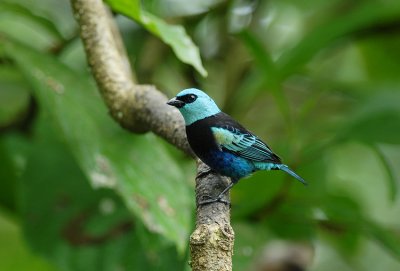
Where is `black chest`? black chest is located at coordinates (199, 143).